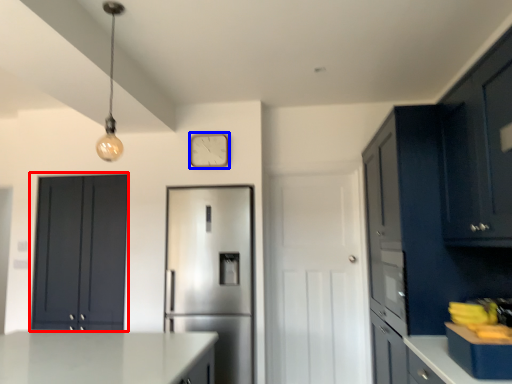
Question: Which object is closer to the camera taking this photo, cabinetry (highlighted by a red box) or clock (highlighted by a blue box)?

Choices:
 (A) cabinetry
 (B) clock

Answer: (A)